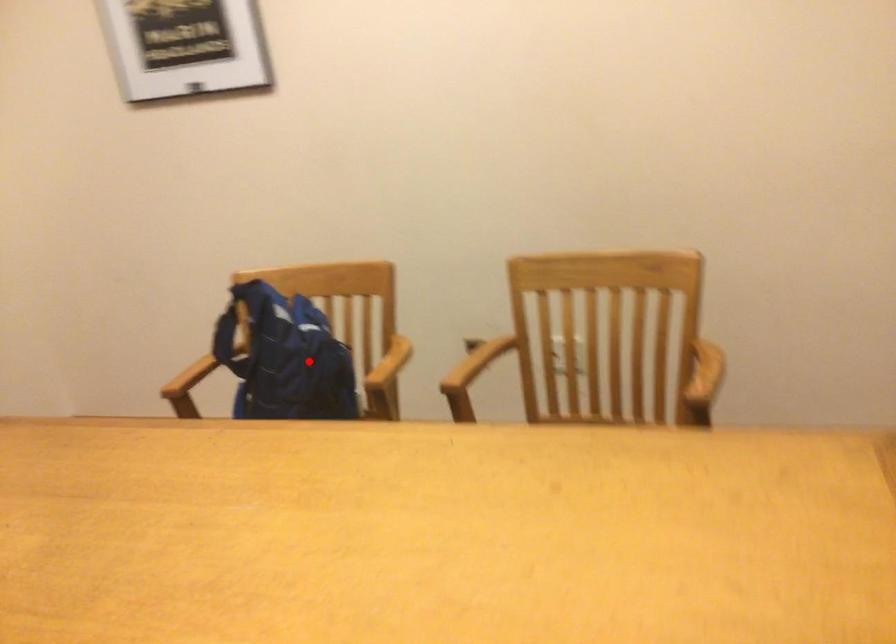
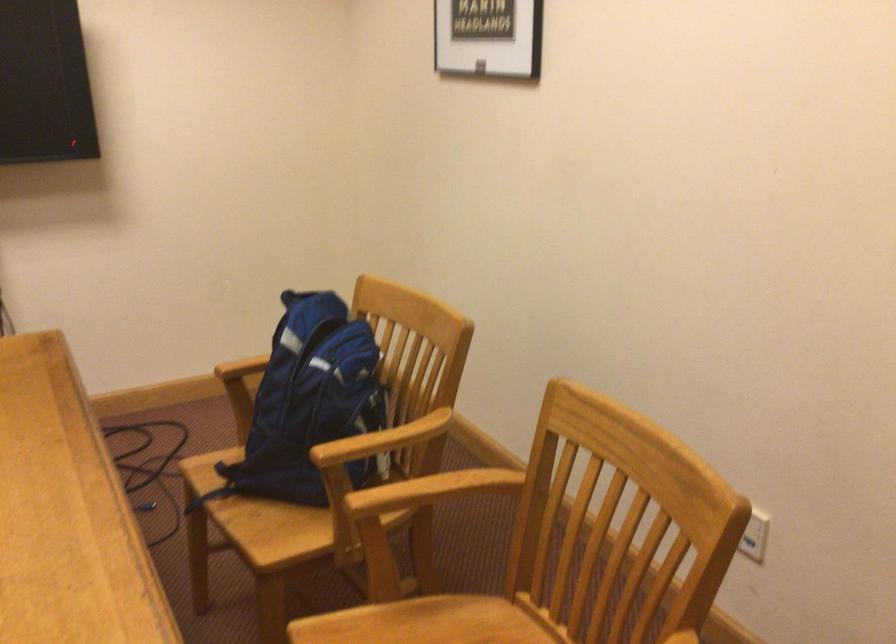
Question: I am providing you with two images of the same scene from different viewpoints. A red point is marked on the first image. Is the red point's position out of view in image 2?

Choices:
 (A) Yes
 (B) No

Answer: (B)